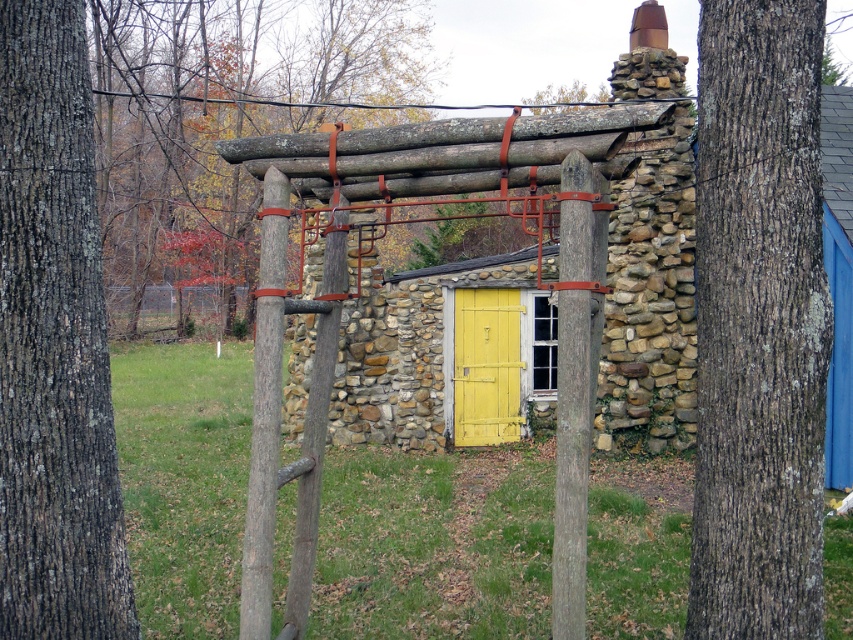
You are standing in front of the rustic stone building and notice two tree trunks. The first is the brown rough bark tree trunk at right, and the second is the dark brown bark at left. From your perspective, which tree trunk is positioned lower in the image?

The brown rough bark tree trunk at right is located below the dark brown bark at left, so it is positioned lower in the image.

From the picture: You are standing in front of the rustic stone building and notice two objects near you. You see the dark brown bark at left and the smooth wood pole at center. Which object is located more to the left?

The dark brown bark at left is more to the left than the smooth wood pole at center.